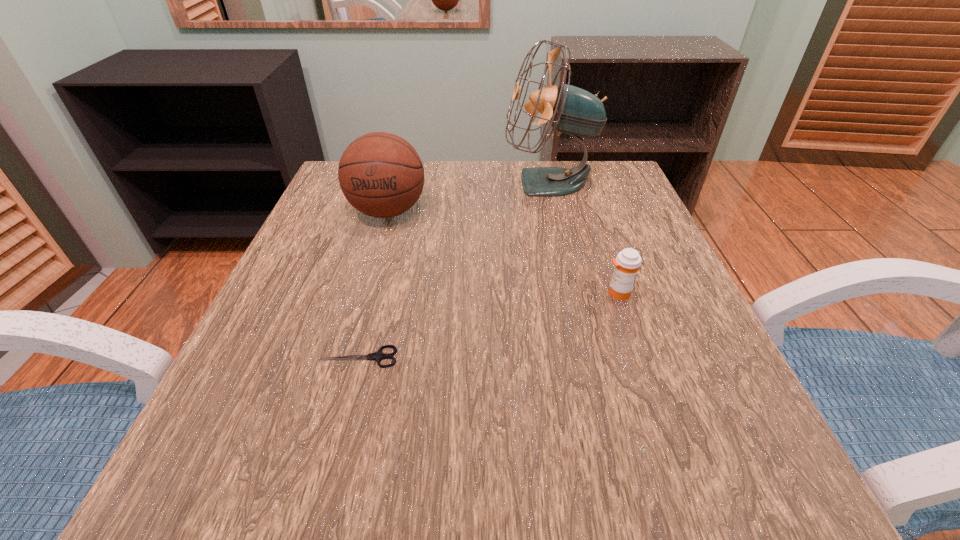
Locate an element on the screen. The height and width of the screenshot is (540, 960). blank region between the third farthest object and the basketball is located at coordinates [503, 252].

Find the location of a particular element. The height and width of the screenshot is (540, 960). free area in between the shortest object and the tallest object is located at coordinates click(454, 270).

Find the location of `free space between the tallest object and the second shortest object`. free space between the tallest object and the second shortest object is located at coordinates (584, 238).

The height and width of the screenshot is (540, 960). In order to click on blank region between the third farthest object and the third shortest object in this screenshot , I will do 503,252.

Find the location of `vacant area between the nearest object and the basketball`. vacant area between the nearest object and the basketball is located at coordinates (373, 284).

The image size is (960, 540). I want to click on free area in between the nearest object and the basketball, so click(373, 284).

The height and width of the screenshot is (540, 960). In order to click on object that is the second closest to the tallest object in this screenshot , I will do `click(627, 263)`.

Image resolution: width=960 pixels, height=540 pixels. I want to click on the second closest object to the medicine, so coord(378,355).

Identify the location of free spot that satisfies the following two spatial constraints: 1. on the side with brand label of the shears; 2. on the left side of the second tallest object. This screenshot has width=960, height=540. (346, 357).

Find the location of `free space that satisfies the following two spatial constraints: 1. on the front-facing side of the second nearest object for air flow; 2. on the right side of the tallest object`. free space that satisfies the following two spatial constraints: 1. on the front-facing side of the second nearest object for air flow; 2. on the right side of the tallest object is located at coordinates (575, 293).